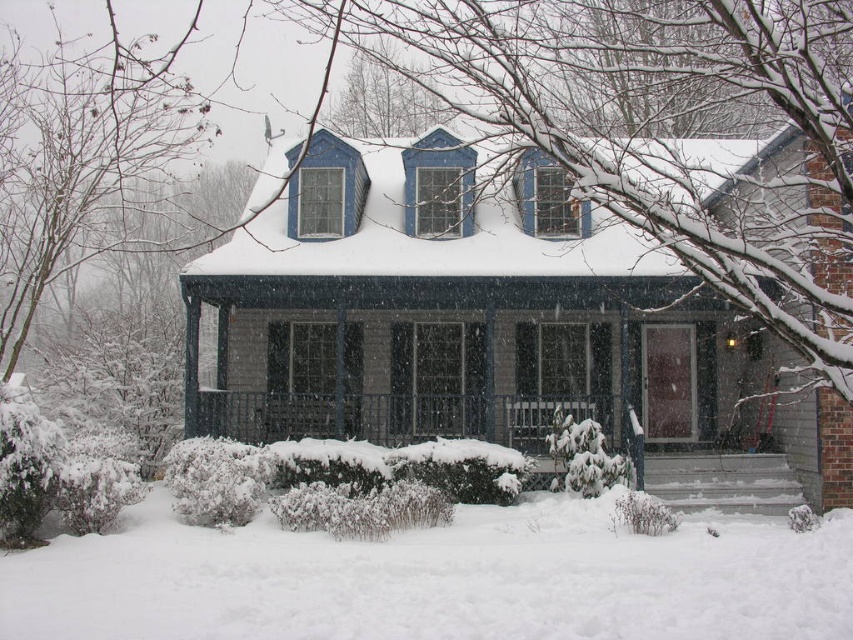
Can you confirm if white fluffy snow at lower center is positioned to the right of smooth gray porch at center?

No, white fluffy snow at lower center is not to the right of smooth gray porch at center.

Can you confirm if white fluffy snow at lower center is positioned below smooth gray porch at center?

Correct, white fluffy snow at lower center is located below smooth gray porch at center.

Does point (136, 536) come in front of point (660, 467)?

Yes, point (136, 536) is closer to viewer.

Identify the location of white fluffy snow at lower center. (437, 579).